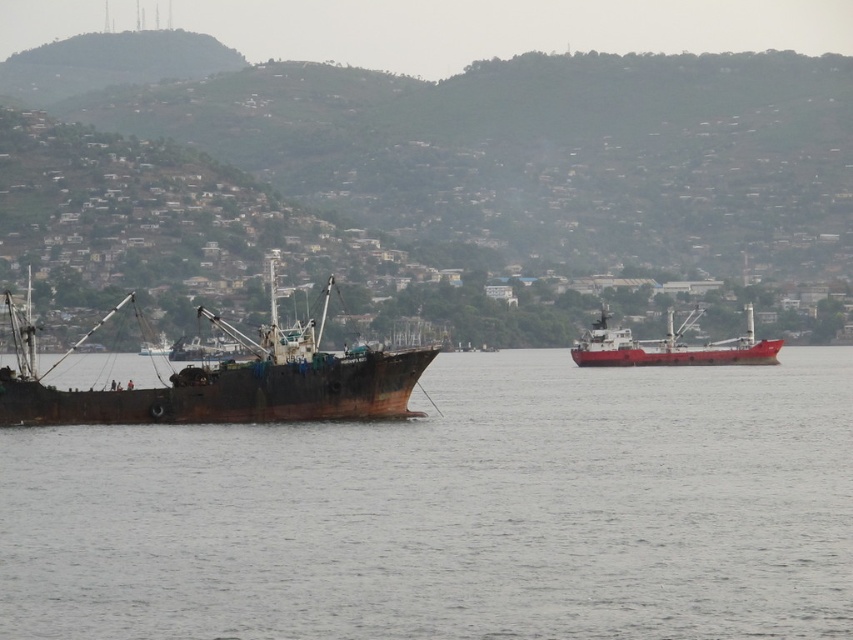
Question: Estimate the real-world distances between objects in this image. Which object is closer to the rusty metal ship at left?

Choices:
 (A) red matte cargo ship at center
 (B) gray matte water at center

Answer: (B)

Question: Which is farther from the gray matte water at center?

Choices:
 (A) rusty metal ship at left
 (B) red matte cargo ship at center

Answer: (B)

Question: Is the position of gray matte water at center less distant than that of red matte cargo ship at center?

Choices:
 (A) yes
 (B) no

Answer: (A)

Question: Which is nearer to the gray matte water at center?

Choices:
 (A) red matte cargo ship at center
 (B) rusty metal ship at left

Answer: (B)

Question: Is gray matte water at center positioned in front of rusty metal ship at left?

Choices:
 (A) no
 (B) yes

Answer: (B)

Question: Can you confirm if gray matte water at center is positioned below red matte cargo ship at center?

Choices:
 (A) no
 (B) yes

Answer: (B)